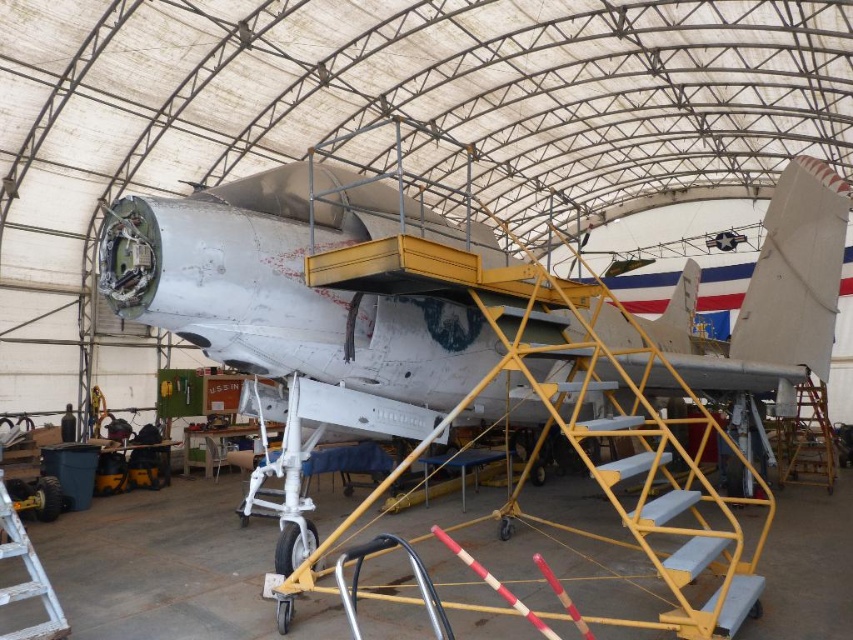
Is point (610, 468) in front of point (35, 561)?

Yes, it is in front of point (35, 561).

Which is behind, point (573, 376) or point (57, 602)?

Point (573, 376)

From the picture: Who is more distant from viewer, (689, 570) or (22, 544)?

The point (22, 544) is behind.

Identify the location of yellow metallic staircase at center. The width and height of the screenshot is (853, 640). click(x=637, y=444).

Does yellow metallic staircase at center appear over yellow metallic ladder at center?

Yes, yellow metallic staircase at center is above yellow metallic ladder at center.

This screenshot has width=853, height=640. In order to click on yellow metallic staircase at center in this screenshot , I will do 637,444.

Is point (799, 406) positioned after point (27, 596)?

Yes, point (799, 406) is farther from viewer.

Is point (799, 467) behind point (0, 509)?

Yes, it is.

Locate an element on the screen. The image size is (853, 640). yellow metallic ladder at center is located at coordinates (805, 440).